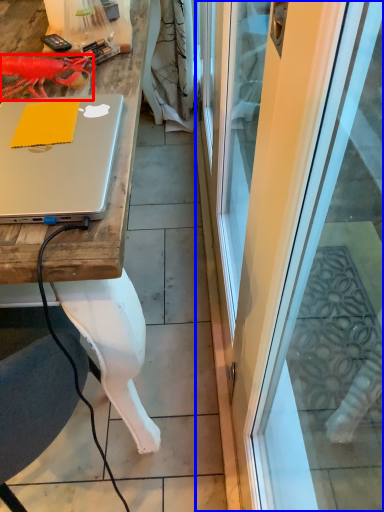
Question: Which point is further to the camera, lobster (highlighted by a red box) or screen door (highlighted by a blue box)?

Choices:
 (A) lobster
 (B) screen door

Answer: (A)